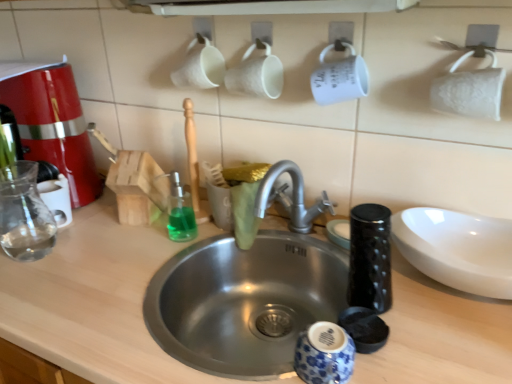
Question: Is transparent glass bottle at left positioned behind clear glass mug at left?

Choices:
 (A) yes
 (B) no

Answer: (B)

Question: Could clear glass mug at left be considered to be inside transparent glass bottle at left?

Choices:
 (A) no
 (B) yes

Answer: (A)

Question: Is transparent glass bottle at left at the left side of clear glass mug at left?

Choices:
 (A) yes
 (B) no

Answer: (A)

Question: From a real-world perspective, is transparent glass bottle at left positioned under clear glass mug at left based on gravity?

Choices:
 (A) yes
 (B) no

Answer: (B)

Question: Is clear glass mug at left at the back of transparent glass bottle at left?

Choices:
 (A) yes
 (B) no

Answer: (A)

Question: Can you confirm if transparent glass bottle at left is positioned to the right of clear glass mug at left?

Choices:
 (A) yes
 (B) no

Answer: (B)

Question: Is transparent glass bottle at left positioned in front of matte red coffee machine at left?

Choices:
 (A) no
 (B) yes

Answer: (B)

Question: Does transparent glass bottle at left have a lesser width compared to matte red coffee machine at left?

Choices:
 (A) no
 (B) yes

Answer: (B)

Question: Is transparent glass bottle at left taller than matte red coffee machine at left?

Choices:
 (A) no
 (B) yes

Answer: (A)

Question: From a real-world perspective, is transparent glass bottle at left positioned under matte red coffee machine at left based on gravity?

Choices:
 (A) yes
 (B) no

Answer: (A)

Question: Is transparent glass bottle at left behind matte red coffee machine at left?

Choices:
 (A) no
 (B) yes

Answer: (A)

Question: Are transparent glass bottle at left and matte red coffee machine at left making contact?

Choices:
 (A) yes
 (B) no

Answer: (B)

Question: Considering the relative sizes of matte red coffee machine at left and stainless steel sink at center in the image provided, is matte red coffee machine at left thinner than stainless steel sink at center?

Choices:
 (A) no
 (B) yes

Answer: (B)